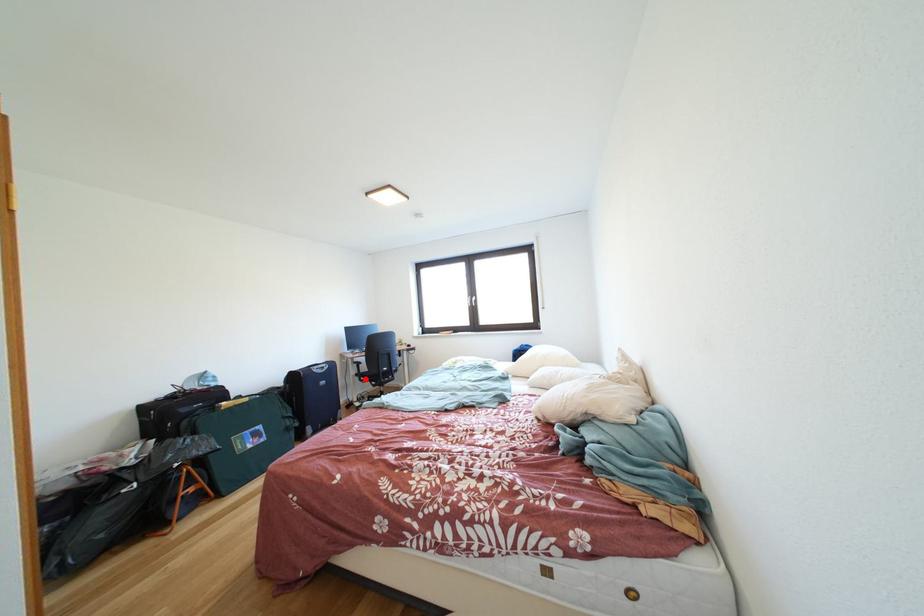
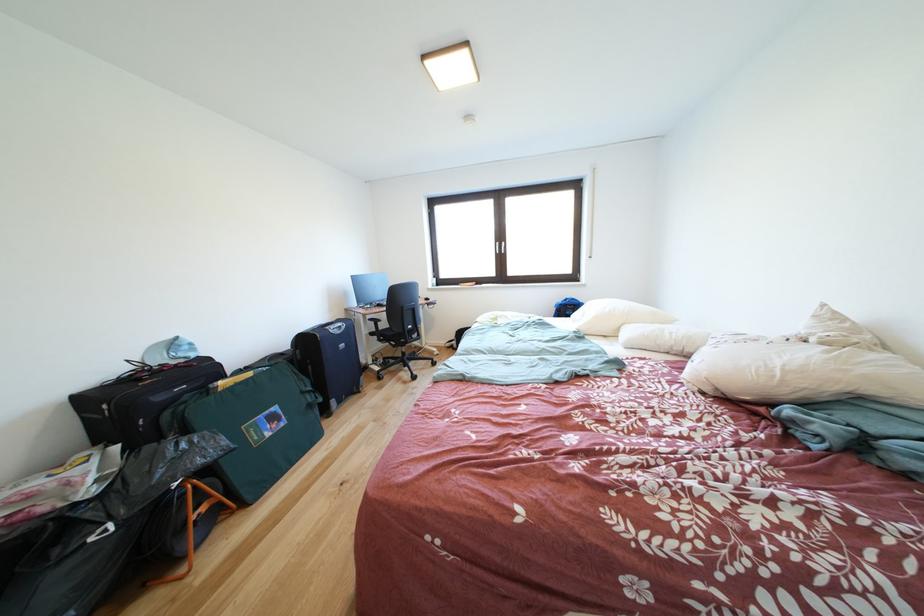
Question: I am providing you with two images of the same scene from different viewpoints. In image1, a red point is highlighted. Considering the same 3D point in image2, which of the following is correct?

Choices:
 (A) It is closer
 (B) It is farther

Answer: (A)